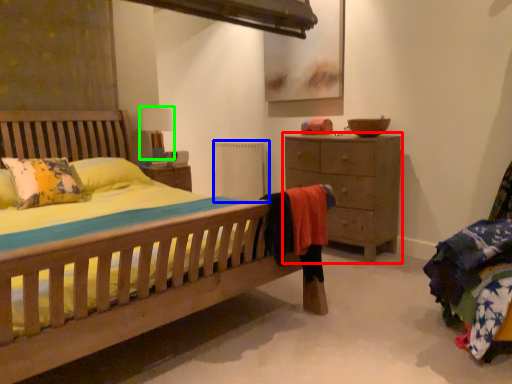
Question: Considering the real-world distances, which object is closest to chest of drawers (highlighted by a red box)? radiator (highlighted by a blue box) or table lamp (highlighted by a green box).

Choices:
 (A) radiator
 (B) table lamp

Answer: (A)